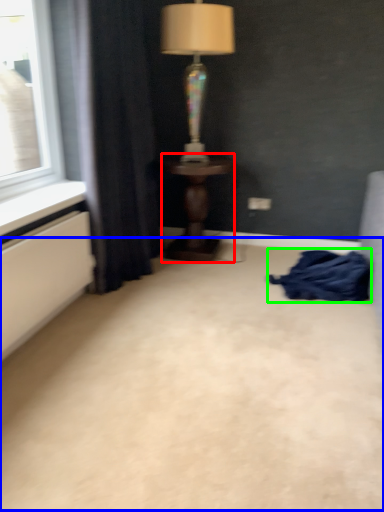
Question: Which is farther away from table (highlighted by a red box)? plain (highlighted by a blue box) or blanket (highlighted by a green box)?

Choices:
 (A) plain
 (B) blanket

Answer: (A)